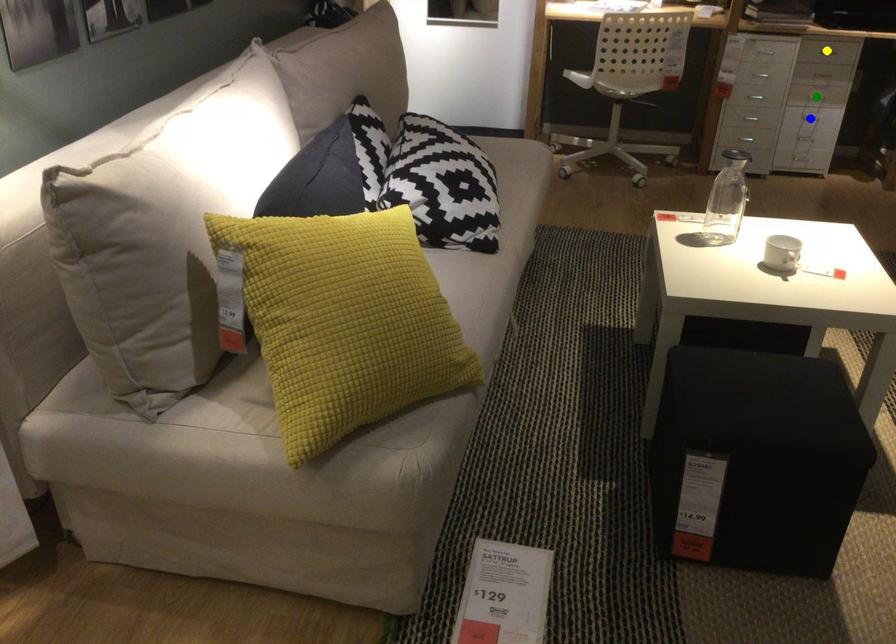
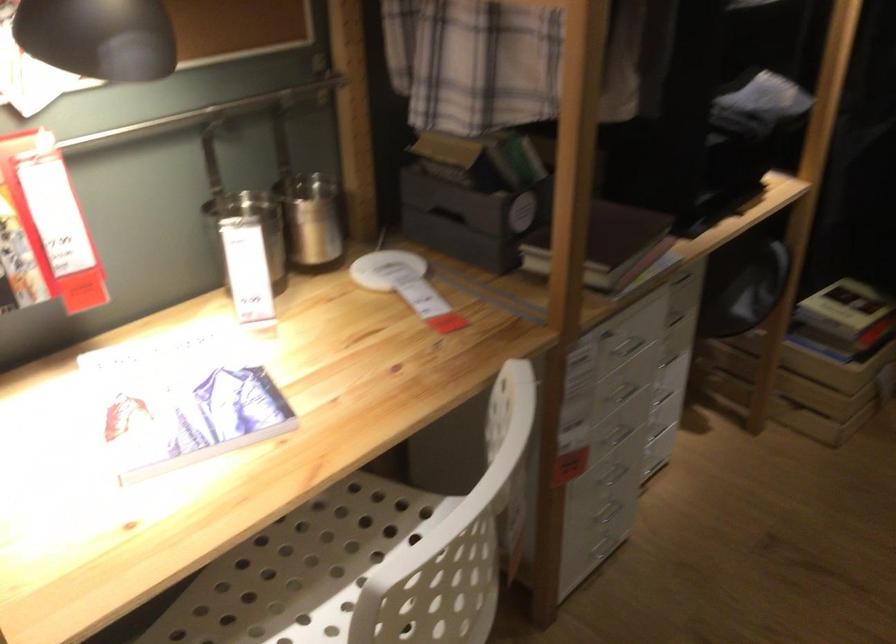
I am providing you with two images of the same scene from different viewpoints. Three points are marked in image1. Which point corresponds to a part or object that is occluded in image2?In image1, three points are marked. Which of them correspond to a part or object that is occluded in image2?Among the three points shown in image1, which one corresponds to a part or object that is no longer visible due to occlusion in image2?

yellow point, blue point, green point cannot be seen in image2.